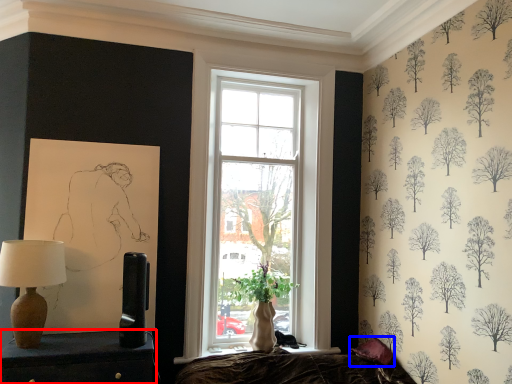
Question: Which object is closer to the camera taking this photo, furniture (highlighted by a red box) or pillow (highlighted by a blue box)?

Choices:
 (A) furniture
 (B) pillow

Answer: (A)